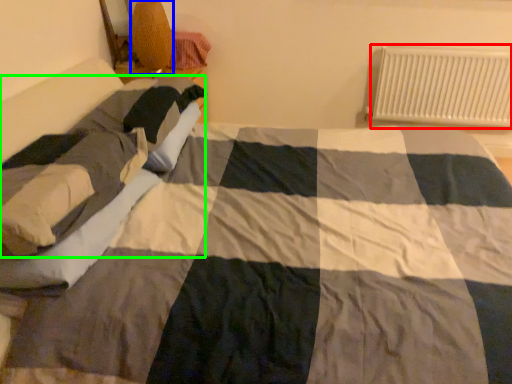
Question: Considering the real-world distances, which object is closest to radiator (highlighted by a red box)? lamp (highlighted by a blue box) or person (highlighted by a green box).

Choices:
 (A) lamp
 (B) person

Answer: (A)